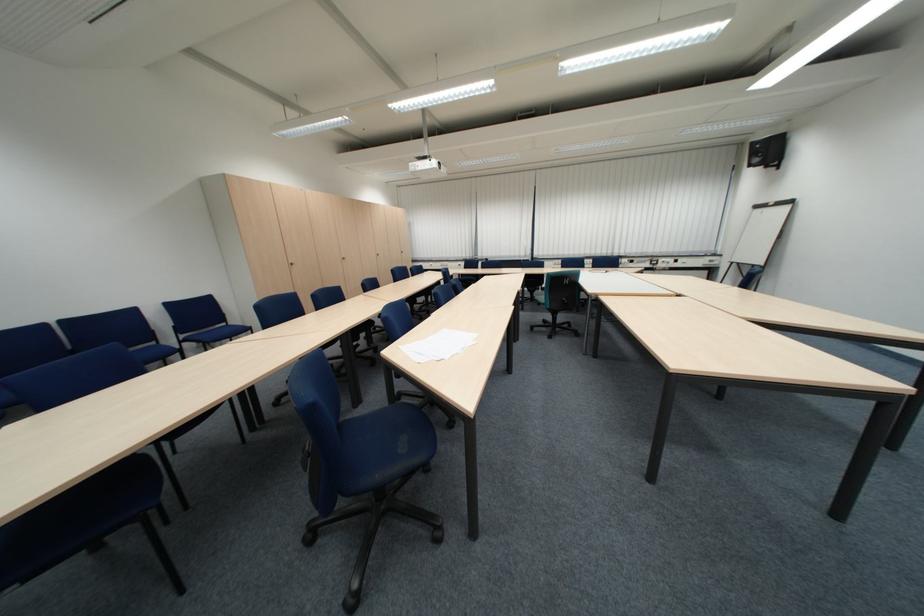
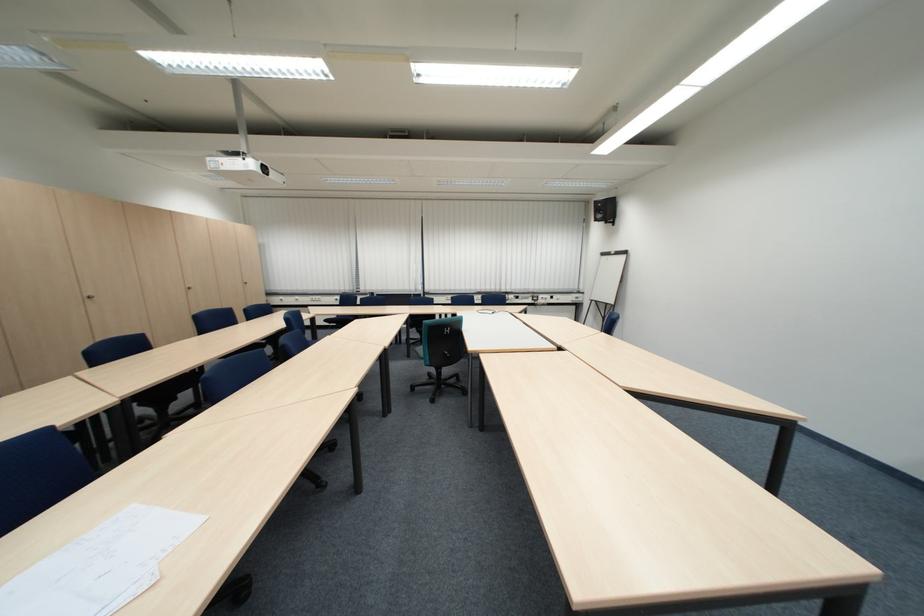
In a continuous first-person perspective shot, in which direction is the camera moving?

The movement direction of the cameraman is right, forward.